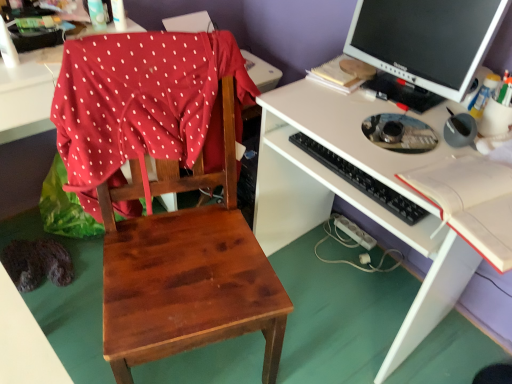
I want to click on wooden chair at center, so click(166, 191).

What is the approximate width of white plastic bottle at upper center, the 2th bottle in the left-to-right sequence?

It is 2.50 inches.

Identify the location of wooden chair at center. (166, 191).

Does point (333, 161) appear closer or farther from the camera than point (154, 319)?

Point (333, 161) appears to be farther away from the viewer than point (154, 319).

Does black plastic keyboard at center have a greater height compared to wooden chair at center?

No, black plastic keyboard at center is not taller than wooden chair at center.

From a real-world perspective, is black plastic keyboard at center positioned above or below wooden chair at center?

Clearly, from a real-world perspective, black plastic keyboard at center is above wooden chair at center.

Find the location of a particular element. This screenshot has width=512, height=384. blanket above the black plastic keyboard at center (from the image's perspective) is located at coordinates (143, 104).

Does red polka dot fabric at left come behind black plastic keyboard at center?

No, red polka dot fabric at left is closer to the camera.

How distant is red polka dot fabric at left from black plastic keyboard at center?

A distance of 16.48 inches exists between red polka dot fabric at left and black plastic keyboard at center.

Considering the sizes of objects red polka dot fabric at left and black plastic keyboard at center in the image provided, who is wider, red polka dot fabric at left or black plastic keyboard at center?

red polka dot fabric at left is wider.

In terms of width, does translucent plastic bottle at upper right, which is the 1th bottle from bottom to top, look wider or thinner when compared to white plastic bottle at upper center, the second bottle positioned from the bottom?

Considering their sizes, translucent plastic bottle at upper right, which is the 1th bottle from bottom to top, looks broader than white plastic bottle at upper center, the second bottle positioned from the bottom.

Is translucent plastic bottle at upper right, acting as the 3th bottle starting from the left, aimed at white plastic bottle at upper center, the second bottle from the right?

No, translucent plastic bottle at upper right, acting as the 3th bottle starting from the left, is not facing towards white plastic bottle at upper center, the second bottle from the right.

From the image's perspective, does translucent plastic bottle at upper right, the 1th bottle when ordered from right to left, appear lower than white plastic bottle at upper center, the 2th bottle in the left-to-right sequence?

Yes, from the image's perspective, translucent plastic bottle at upper right, the 1th bottle when ordered from right to left, is below white plastic bottle at upper center, the 2th bottle in the left-to-right sequence.

Is translucent plastic bottle at upper right, the 1th bottle when ordered from right to left, not close to white plastic bottle at upper center, which ranks as the 2th bottle in top-to-bottom order?

translucent plastic bottle at upper right, the 1th bottle when ordered from right to left, is far away from white plastic bottle at upper center, which ranks as the 2th bottle in top-to-bottom order.

Can you tell me how much wooden chair at center and red polka dot fabric at left differ in facing direction?

wooden chair at center and red polka dot fabric at left are facing 0.000163 degrees away from each other.

Which is closer to the camera, (269, 276) or (145, 48)?

Point (269, 276).

Is wooden chair at center inside the boundaries of red polka dot fabric at left, or outside?

wooden chair at center exists outside the volume of red polka dot fabric at left.

Does black plastic keyboard at center have a smaller size compared to clear plastic bottle at upper left, the 1th bottle positioned from the top?

No.

Who is shorter, black plastic keyboard at center or clear plastic bottle at upper left, marked as the third bottle in a bottom-to-top arrangement?

black plastic keyboard at center is shorter.

Does black plastic keyboard at center have a lesser width compared to clear plastic bottle at upper left, the 1th bottle positioned from the top?

No, black plastic keyboard at center is not thinner than clear plastic bottle at upper left, the 1th bottle positioned from the top.

Is point (369, 179) closer to viewer compared to point (88, 0)?

Yes.

Does red polka dot fabric at left contain white plastic bottle at upper center, the second bottle positioned from the bottom?

That's incorrect, white plastic bottle at upper center, the second bottle positioned from the bottom, is not inside red polka dot fabric at left.

Is red polka dot fabric at left oriented away from white plastic bottle at upper center, the second bottle positioned from the bottom?

Yes, red polka dot fabric at left's orientation is away from white plastic bottle at upper center, the second bottle positioned from the bottom.

Is point (71, 53) closer or farther from the camera than point (114, 2)?

Point (71, 53).

Does point (369, 50) come closer to viewer compared to point (145, 335)?

No, (369, 50) is behind (145, 335).

Is matte black monitor at upper right facing away from wooden chair at center?

No, wooden chair at center is not at the back of matte black monitor at upper right.

In terms of size, does matte black monitor at upper right appear bigger or smaller than wooden chair at center?

In the image, matte black monitor at upper right appears to be smaller than wooden chair at center.

Looking at this image, how far apart are matte black monitor at upper right and wooden chair at center?

matte black monitor at upper right and wooden chair at center are 23.57 inches apart from each other.

Where is `chair on the left of black plastic keyboard at center`? The image size is (512, 384). chair on the left of black plastic keyboard at center is located at coordinates (166, 191).

The height and width of the screenshot is (384, 512). What are the coordinates of `computer keyboard behind the red polka dot fabric at left` in the screenshot? It's located at (361, 180).

Which object lies nearer to the anchor point wooden chair at center, clear plastic bottle at upper left, the third bottle from the right, or translucent plastic bottle at upper right, the 1th bottle when ordered from right to left?

The object closer to wooden chair at center is clear plastic bottle at upper left, the third bottle from the right.

Considering their positions, is translucent plastic bottle at upper right, acting as the 3th bottle starting from the left, positioned further to white plastic bottle at upper center, the second bottle positioned from the bottom, than white matte desk at center?

translucent plastic bottle at upper right, acting as the 3th bottle starting from the left, lies further to white plastic bottle at upper center, the second bottle positioned from the bottom, than the other object.

Considering their positions, is white matte desk at center positioned closer to matte black monitor at upper right than wooden chair at center?

white matte desk at center lies closer to matte black monitor at upper right than the other object.

Looking at the image, which one is located closer to wooden chair at center, white plastic bottle at upper center, which ranks as the 2th bottle in top-to-bottom order, or translucent plastic bottle at upper right, which is the 1th bottle from bottom to top?

Among the two, white plastic bottle at upper center, which ranks as the 2th bottle in top-to-bottom order, is located nearer to wooden chair at center.

From the picture: From the image, which object appears to be nearer to matte black monitor at upper right, wooden chair at center or white matte desk at center?

Based on the image, white matte desk at center appears to be nearer to matte black monitor at upper right.

From the image, which object appears to be farther from white matte desk at center, translucent plastic bottle at upper right, acting as the 3th bottle starting from the left, or black plastic keyboard at center?

Among the two, translucent plastic bottle at upper right, acting as the 3th bottle starting from the left, is located further to white matte desk at center.

Estimate the real-world distances between objects in this image. Which object is further from white matte desk at center, clear plastic bottle at upper left, marked as the third bottle in a bottom-to-top arrangement, or red polka dot fabric at left?

clear plastic bottle at upper left, marked as the third bottle in a bottom-to-top arrangement, lies further to white matte desk at center than the other object.

Looking at the image, which one is located closer to matte black monitor at upper right, white matte desk at center or clear plastic bottle at upper left, the third bottle from the right?

white matte desk at center is positioned closer to the anchor matte black monitor at upper right.

The height and width of the screenshot is (384, 512). In order to click on desk between wooden chair at center and matte black monitor at upper right from left to right in this screenshot , I will do `click(349, 201)`.

The width and height of the screenshot is (512, 384). I want to click on computer monitor located between wooden chair at center and translucent plastic bottle at upper right, which is the 1th bottle from bottom to top, in the left-right direction, so click(x=426, y=39).

Locate an element on the screen. This screenshot has width=512, height=384. bottle located between clear plastic bottle at upper left, the first bottle viewed from the left, and black plastic keyboard at center in the left-right direction is located at coordinates (119, 15).

At what (x,y) coordinates should I click in order to perform the action: click on computer keyboard located between white plastic bottle at upper center, which ranks as the 2th bottle in top-to-bottom order, and matte black monitor at upper right in the left-right direction. Please return your answer as a coordinate pair (x, y). The width and height of the screenshot is (512, 384). Looking at the image, I should click on (361, 180).